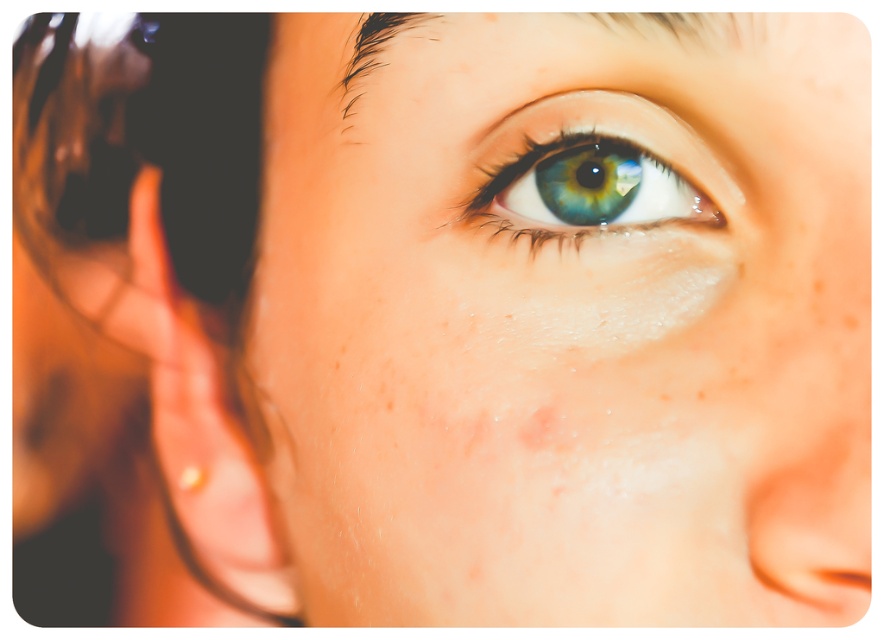
Can you confirm if smooth skin eye at center is smaller than gold metallic earring at lower left?

Incorrect, smooth skin eye at center is not smaller in size than gold metallic earring at lower left.

Can you confirm if smooth skin eye at center is positioned to the right of gold metallic earring at lower left?

Indeed, smooth skin eye at center is positioned on the right side of gold metallic earring at lower left.

Is point (303, 353) positioned before point (199, 465)?

Yes, point (303, 353) is in front of point (199, 465).

Identify the location of smooth skin eye at center. point(568,320).

Between smooth skin eye at center and green glossy eye at center, which one is positioned higher?

green glossy eye at center is above.

Does smooth skin eye at center have a larger size compared to green glossy eye at center?

Correct, smooth skin eye at center is larger in size than green glossy eye at center.

Between point (839, 52) and point (568, 228), which one is positioned in front?

Point (839, 52) is more forward.

Locate an element on the screen. This screenshot has width=884, height=640. smooth skin eye at center is located at coordinates (568, 320).

Is green glossy eye at center to the right of gold metallic earring at lower left from the viewer's perspective?

Yes, green glossy eye at center is to the right of gold metallic earring at lower left.

The width and height of the screenshot is (884, 640). Find the location of `green glossy eye at center`. green glossy eye at center is located at coordinates (593, 176).